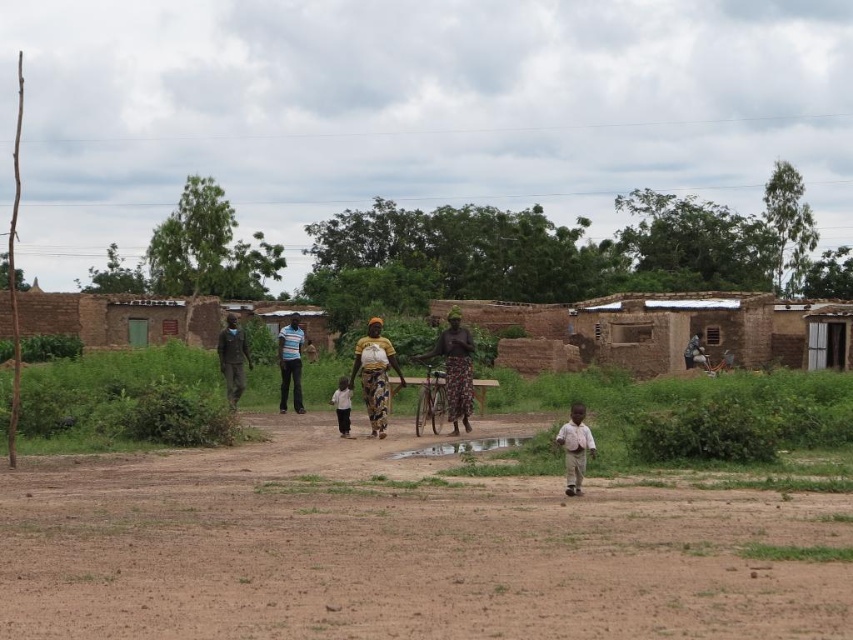
Can you confirm if brown mud huts at center is thinner than white cotton shirt at center?

In fact, brown mud huts at center might be wider than white cotton shirt at center.

Which of these two, brown mud huts at center or white cotton shirt at center, stands taller?

brown mud huts at center is taller.

In order to click on brown mud huts at center in this screenshot , I will do `click(671, 328)`.

Who is shorter, brown soil at lower center or dark blue fabric shirt at left?

brown soil at lower center is shorter.

How distant is brown soil at lower center from dark blue fabric shirt at left?

43.22 feet

Is point (56, 582) positioned after point (228, 339)?

That is False.

You are a GUI agent. You are given a task and a screenshot of the screen. Output one action in this format:
    pyautogui.click(x=<x>, y=<y>)
    Task: Click on the brown soil at lower center
    The height and width of the screenshot is (640, 853).
    Given the screenshot: What is the action you would take?
    pyautogui.click(x=398, y=548)

Between brown mud huts at center and patterned fabric dress at center, which one appears on the right side from the viewer's perspective?

patterned fabric dress at center

Can you confirm if brown mud huts at center is positioned to the left of patterned fabric dress at center?

Yes, brown mud huts at center is to the left of patterned fabric dress at center.

Is point (0, 323) closer to viewer compared to point (465, 381)?

No, it is not.

Find the location of a particular element. The width and height of the screenshot is (853, 640). brown mud huts at center is located at coordinates (671, 328).